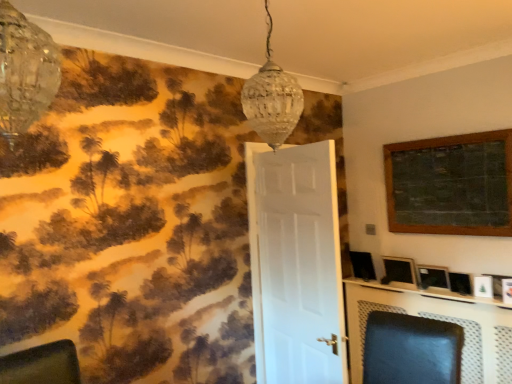
Question: From a real-world perspective, is white matte door at center located higher than matte black swivel chair at center?

Choices:
 (A) yes
 (B) no

Answer: (A)

Question: Does white matte door at center have a lesser width compared to matte black swivel chair at center?

Choices:
 (A) no
 (B) yes

Answer: (B)

Question: Can you confirm if white matte door at center is taller than matte black swivel chair at center?

Choices:
 (A) yes
 (B) no

Answer: (A)

Question: Is the surface of white matte door at center in direct contact with matte black swivel chair at center?

Choices:
 (A) no
 (B) yes

Answer: (A)

Question: Could you tell me if white matte door at center is facing matte black swivel chair at center?

Choices:
 (A) yes
 (B) no

Answer: (B)

Question: From the image's perspective, is clear glass chandelier at upper left, which is counted as the 2th lamp, starting from the right, positioned above or below matte black picture frame at right, acting as the second picture frame starting from the top?

Choices:
 (A) below
 (B) above

Answer: (B)

Question: Is clear glass chandelier at upper left, the first lamp from the left, taller or shorter than matte black picture frame at right, the third picture frame in the bottom-to-top sequence?

Choices:
 (A) tall
 (B) short

Answer: (A)

Question: In the image, is clear glass chandelier at upper left, positioned as the first lamp in front-to-back order, positioned in front of or behind matte black picture frame at right, acting as the second picture frame starting from the top?

Choices:
 (A) behind
 (B) front

Answer: (B)

Question: Is clear glass chandelier at upper left, placed as the 2th lamp when sorted from back to front, inside the boundaries of matte black picture frame at right, acting as the second picture frame starting from the top, or outside?

Choices:
 (A) outside
 (B) inside

Answer: (A)

Question: Considering the positions of matte black picture frame at right, the 4th picture frame positioned from the top, and white matte door at center in the image, is matte black picture frame at right, the 4th picture frame positioned from the top, taller or shorter than white matte door at center?

Choices:
 (A) tall
 (B) short

Answer: (B)

Question: Considering the positions of point (454, 274) and point (254, 339), is point (454, 274) closer or farther from the camera than point (254, 339)?

Choices:
 (A) farther
 (B) closer

Answer: (A)

Question: Considering their positions, is matte black picture frame at right, the first picture frame when ordered from bottom to top, located in front of or behind white matte door at center?

Choices:
 (A) behind
 (B) front

Answer: (A)

Question: Considering the positions of matte black picture frame at right, the 4th picture frame positioned from the top, and white matte door at center in the image, is matte black picture frame at right, the 4th picture frame positioned from the top, wider or thinner than white matte door at center?

Choices:
 (A) thin
 (B) wide

Answer: (A)

Question: From a real-world perspective, is matte black picture frame at right, the first picture frame when ordered from bottom to top, positioned above or below wooden framed chalkboard at upper right, the first picture frame in the top-to-bottom sequence?

Choices:
 (A) above
 (B) below

Answer: (B)

Question: Choose the correct answer: Is matte black picture frame at right, the 4th picture frame positioned from the top, inside wooden framed chalkboard at upper right, the fourth picture frame from the bottom, or outside it?

Choices:
 (A) outside
 (B) inside

Answer: (A)